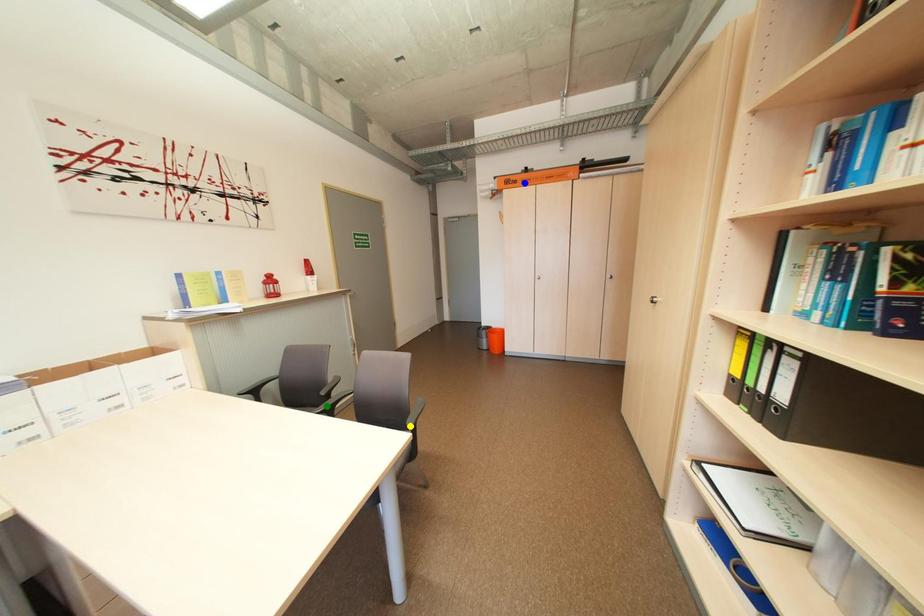
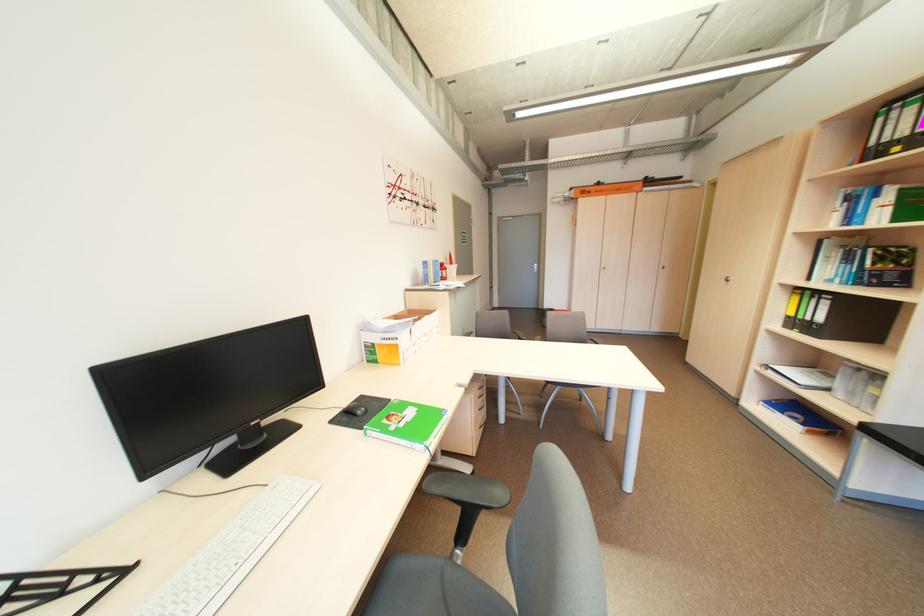
I am providing you with two images of the same scene from different viewpoints. Three points are marked in image1. Which point corresponds to a part or object that is occluded in image2?In image1, three points are marked. Which of them correspond to a part or object that is occluded in image2?Among the three points shown in image1, which one corresponds to a part or object that is no longer visible due to occlusion in image2?

green point, yellow point cannot be seen in image2.